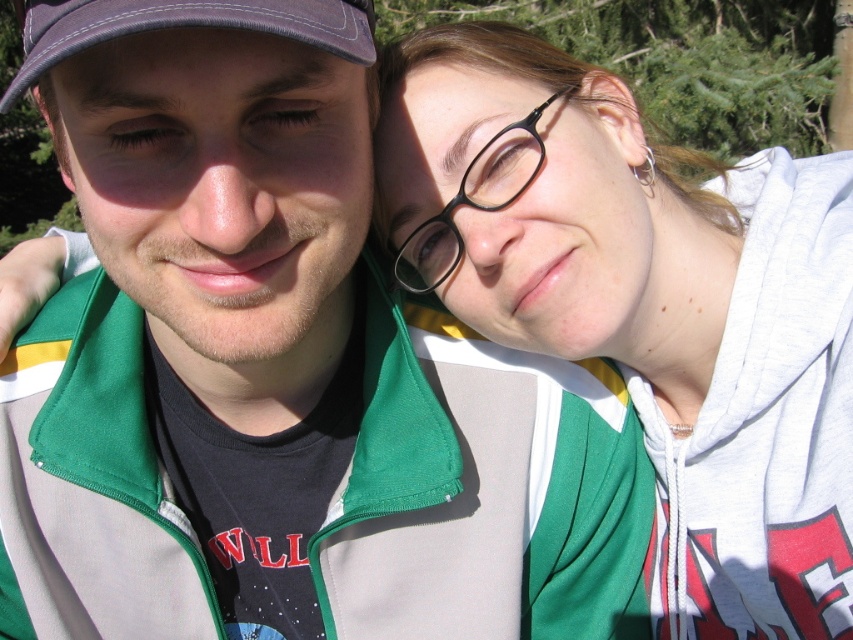
Between matte green hoodie at upper right and purple fabric baseball cap at upper left, which one is positioned lower?

matte green hoodie at upper right is below.

Does matte green hoodie at upper right lie behind purple fabric baseball cap at upper left?

Yes, it is.

Describe the element at coordinates (648, 307) in the screenshot. I see `matte green hoodie at upper right` at that location.

Locate an element on the screen. matte green hoodie at upper right is located at coordinates (648, 307).

Is point (195, 13) closer to viewer compared to point (498, 154)?

Yes, it is in front of point (498, 154).

Is purple fabric baseball cap at upper left taller than black plastic glasses at upper right?

Incorrect, purple fabric baseball cap at upper left's height is not larger of black plastic glasses at upper right's.

Measure the distance between purple fabric baseball cap at upper left and camera.

purple fabric baseball cap at upper left and camera are 24.95 inches apart.

Find the location of `purple fabric baseball cap at upper left`. purple fabric baseball cap at upper left is located at coordinates (183, 26).

Does matte green hoodie at upper right have a lesser width compared to black plastic glasses at upper right?

No.

Does matte green hoodie at upper right have a larger size compared to black plastic glasses at upper right?

Yes.

Measure the distance between point (784, 205) and camera.

Point (784, 205) is 3.98 feet away from camera.

Image resolution: width=853 pixels, height=640 pixels. In order to click on matte green hoodie at upper right in this screenshot , I will do `click(648, 307)`.